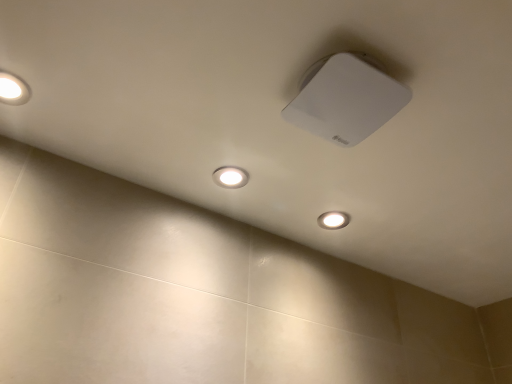
Question: From the image's perspective, is matte white light at lower center above or below white matte square at upper center, positioned as the 2th lamp in left-to-right order?

Choices:
 (A) above
 (B) below

Answer: (B)

Question: Does point (330, 213) appear closer or farther from the camera than point (353, 82)?

Choices:
 (A) closer
 (B) farther

Answer: (B)

Question: Estimate the real-world distances between objects in this image. Which object is farther from the matte white light at upper left, the second lamp viewed from the right?

Choices:
 (A) matte white light at lower center
 (B) white matte square at upper center, positioned as the 2th lamp in left-to-right order

Answer: (A)

Question: Estimate the real-world distances between objects in this image. Which object is closer to the matte white light at lower center?

Choices:
 (A) matte white light at upper left, the first lamp in the left-to-right sequence
 (B) white matte square at upper center, positioned as the 2th lamp in left-to-right order

Answer: (B)